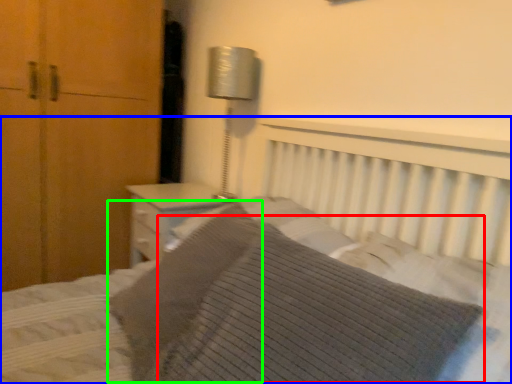
Question: Considering the real-world distances, which object is closest to pillow (highlighted by a red box)? bed (highlighted by a blue box) or pillow (highlighted by a green box).

Choices:
 (A) bed
 (B) pillow

Answer: (A)